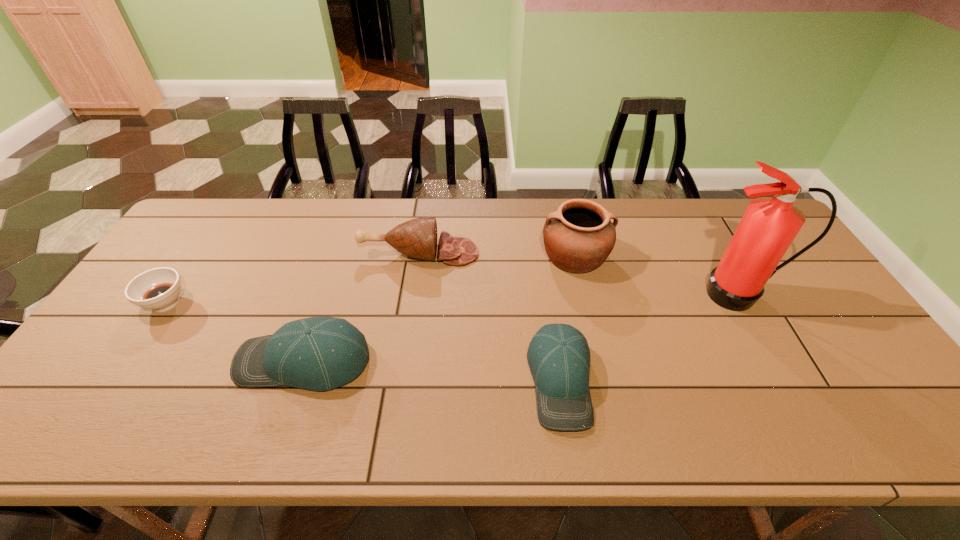
This screenshot has height=540, width=960. I want to click on vacant space situated 0.240m on the back of the right baseball cap, so tap(544, 271).

Find the location of a particular element. The height and width of the screenshot is (540, 960). vacant region located on the front of the pottery is located at coordinates (598, 361).

At what (x,y) coordinates should I click in order to perform the action: click on vacant space situated on the right of the soup bowl. Please return your answer as a coordinate pair (x, y). Looking at the image, I should click on (x=315, y=303).

Where is `vacant space located at the sliced end of the ham`? vacant space located at the sliced end of the ham is located at coordinates (511, 253).

Where is `vacant space located at the spray nozzle of the tallest object`? The height and width of the screenshot is (540, 960). vacant space located at the spray nozzle of the tallest object is located at coordinates click(794, 392).

I want to click on pottery situated at the far edge, so click(578, 237).

This screenshot has width=960, height=540. In order to click on ham that is at the far edge in this screenshot , I will do (x=417, y=238).

Locate an element on the screen. This screenshot has width=960, height=540. object that is at the left edge is located at coordinates (158, 289).

I want to click on object present at the right edge, so click(769, 225).

You are a GUI agent. You are given a task and a screenshot of the screen. Output one action in this format:
    pyautogui.click(x=<x>, y=<y>)
    Task: Click on the vacant space at the far edge
    The height and width of the screenshot is (540, 960).
    Given the screenshot: What is the action you would take?
    pyautogui.click(x=398, y=199)